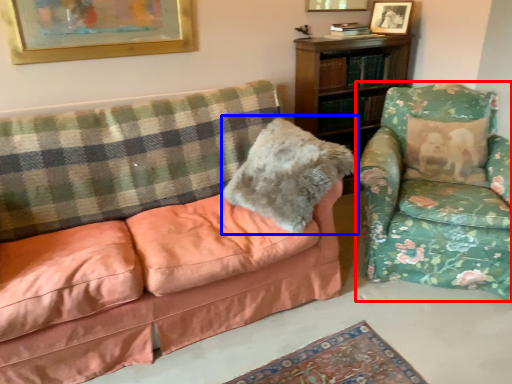
Question: Which of the following is the farthest to the observer, chair (highlighted by a red box) or throw pillow (highlighted by a blue box)?

Choices:
 (A) chair
 (B) throw pillow

Answer: (B)